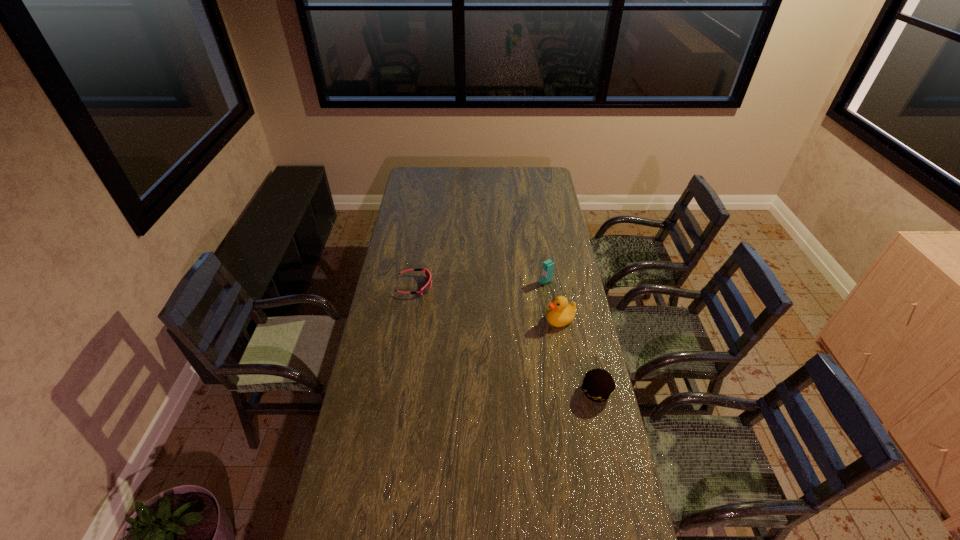
Find the location of a particular element. This screenshot has height=540, width=960. vacant space on the desktop that is between the goggles and the nearest object and is positioned at the beak of the third shortest object is located at coordinates [x=507, y=340].

The image size is (960, 540). What are the coordinates of `free space on the desktop that is between the goggles and the nearest object and is positioned on the keypad of the tallest object` in the screenshot? It's located at (471, 319).